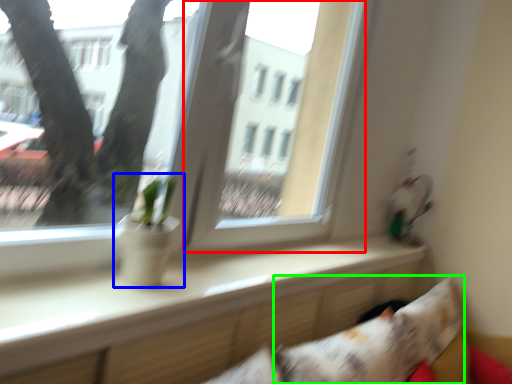
Question: Considering the real-world distances, which object is closest to window screen (highlighted by a red box)? houseplant (highlighted by a blue box) or pillow (highlighted by a green box).

Choices:
 (A) houseplant
 (B) pillow

Answer: (A)